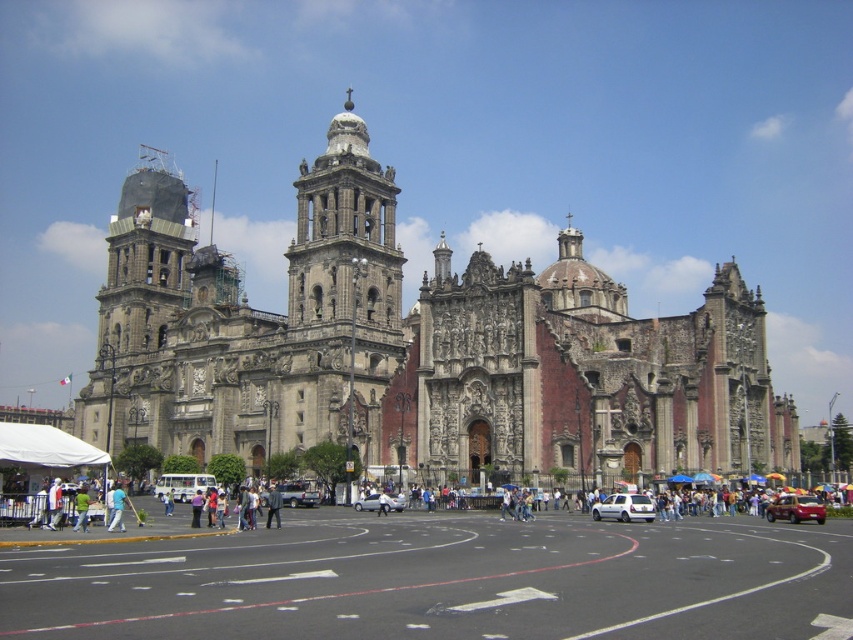
Is white matte van at center below blue fabric person at lower left?

Incorrect, white matte van at center is not positioned below blue fabric person at lower left.

Can you confirm if white matte van at center is positioned above blue fabric person at lower left?

Indeed, white matte van at center is positioned over blue fabric person at lower left.

Between point (614, 497) and point (113, 506), which one is positioned behind?

The point (614, 497) is behind.

What are the coordinates of `white matte van at center` in the screenshot? It's located at (624, 508).

Can you confirm if gray stone church at center is thinner than green fabric bag at center?

In fact, gray stone church at center might be wider than green fabric bag at center.

Between gray stone church at center and green fabric bag at center, which one has more height?

gray stone church at center

Does point (479, 342) come closer to viewer compared to point (80, 516)?

No.

This screenshot has width=853, height=640. In order to click on gray stone church at center in this screenshot , I will do `click(416, 348)`.

Does point (374, 497) come closer to viewer compared to point (119, 488)?

Yes, point (374, 497) is in front of point (119, 488).

Image resolution: width=853 pixels, height=640 pixels. I want to click on white matte car at center, so click(x=367, y=502).

Identify the location of white matte car at center. The height and width of the screenshot is (640, 853). (367, 502).

You are a GUI agent. You are given a task and a screenshot of the screen. Output one action in this format:
    pyautogui.click(x=<x>, y=<y>)
    Task: Click on the white matte car at center
    Image resolution: width=853 pixels, height=640 pixels.
    Given the screenshot: What is the action you would take?
    click(x=367, y=502)